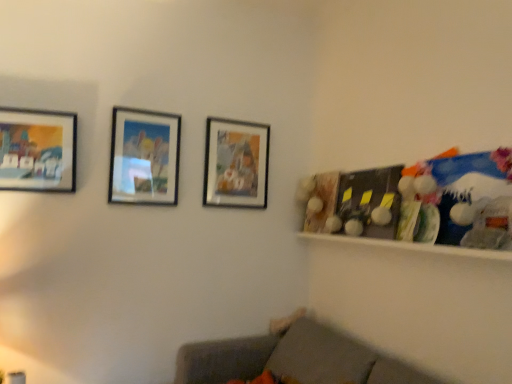
I want to click on white glossy shelf at right, so click(x=412, y=246).

You are a GUI agent. You are given a task and a screenshot of the screen. Output one action in this format:
    pyautogui.click(x=<x>, y=<y>)
    Task: Click on the matte wooden picture frame at center, which is counted as the 3th picture frame, starting from the front
    The height and width of the screenshot is (384, 512).
    Given the screenshot: What is the action you would take?
    pyautogui.click(x=236, y=164)

Is white glossy shelf at right facing away from matte glass picture frame at center, acting as the 2th picture frame starting from the front?

white glossy shelf at right does not have its back to matte glass picture frame at center, acting as the 2th picture frame starting from the front.

Is white glossy shelf at right closer to camera compared to matte glass picture frame at center, acting as the 2th picture frame starting from the front?

Yes, white glossy shelf at right is in front of matte glass picture frame at center, acting as the 2th picture frame starting from the front.

How different are the orientations of white glossy shelf at right and matte glass picture frame at center, acting as the 2th picture frame starting from the front, in degrees?

The facing directions of white glossy shelf at right and matte glass picture frame at center, acting as the 2th picture frame starting from the front, are 90.5 degrees apart.

Does gray fabric couch at lower center have a lesser height compared to matte wooden picture frame at left, the first picture frame when ordered from left to right?

No.

Considering the sizes of objects gray fabric couch at lower center and matte wooden picture frame at left, which appears as the third picture frame when viewed from the back, in the image provided, who is smaller, gray fabric couch at lower center or matte wooden picture frame at left, which appears as the third picture frame when viewed from the back,?

matte wooden picture frame at left, which appears as the third picture frame when viewed from the back.

Locate an element on the screen. The width and height of the screenshot is (512, 384). the 1st picture frame above the gray fabric couch at lower center (from a real-world perspective) is located at coordinates (38, 150).

Is gray fabric couch at lower center not close to matte wooden picture frame at left, which is the 3th picture frame from right to left?

gray fabric couch at lower center is positioned a significant distance from matte wooden picture frame at left, which is the 3th picture frame from right to left.

Is matte glass picture frame at center, which appears as the 2th picture frame when viewed from the back, turned away from matte wooden picture frame at center, marked as the 3th picture frame in a left-to-right arrangement?

No, matte glass picture frame at center, which appears as the 2th picture frame when viewed from the back, is not facing the opposite direction of matte wooden picture frame at center, marked as the 3th picture frame in a left-to-right arrangement.

Considering the positions of objects matte glass picture frame at center, which is counted as the second picture frame, starting from the left, and matte wooden picture frame at center, marked as the 1th picture frame in a back-to-front arrangement, in the image provided, who is in front, matte glass picture frame at center, which is counted as the second picture frame, starting from the left, or matte wooden picture frame at center, marked as the 1th picture frame in a back-to-front arrangement,?

matte glass picture frame at center, which is counted as the second picture frame, starting from the left, is closer to the camera.

Considering the relative sizes of matte glass picture frame at center, which appears as the 2th picture frame when viewed from the back, and matte wooden picture frame at center, acting as the 1th picture frame starting from the right, in the image provided, is matte glass picture frame at center, which appears as the 2th picture frame when viewed from the back, taller than matte wooden picture frame at center, acting as the 1th picture frame starting from the right,?

In fact, matte glass picture frame at center, which appears as the 2th picture frame when viewed from the back, may be shorter than matte wooden picture frame at center, acting as the 1th picture frame starting from the right.

Between matte glass picture frame at center, which appears as the 2th picture frame when viewed from the back, and matte wooden picture frame at center, marked as the 3th picture frame in a left-to-right arrangement, which one appears on the left side from the viewer's perspective?

From the viewer's perspective, matte glass picture frame at center, which appears as the 2th picture frame when viewed from the back, appears more on the left side.

There is a white glossy shelf at right. Where is `the 3rd picture frame above it (from the image's perspective)`? This screenshot has width=512, height=384. the 3rd picture frame above it (from the image's perspective) is located at coordinates [x=38, y=150].

Does matte wooden picture frame at left, the first picture frame when ordered from left to right, lie behind white glossy shelf at right?

That is True.

From a real-world perspective, is matte wooden picture frame at left, which is the first picture frame from front to back, positioned above or below white glossy shelf at right?

matte wooden picture frame at left, which is the first picture frame from front to back, is situated higher than white glossy shelf at right in the real world.

Is matte wooden picture frame at left, which is the first picture frame from front to back, far away from white glossy shelf at right?

Yes, matte wooden picture frame at left, which is the first picture frame from front to back, and white glossy shelf at right are located far from each other.

Can you confirm if matte wooden picture frame at center, marked as the 1th picture frame in a back-to-front arrangement, is smaller than matte wooden picture frame at left, which is the 3th picture frame from right to left?

No.

Looking at this image, from a real-world perspective, does matte wooden picture frame at center, acting as the 1th picture frame starting from the right, stand above matte wooden picture frame at left, which is the 3th picture frame from right to left?

Yes, from a real-world perspective, matte wooden picture frame at center, acting as the 1th picture frame starting from the right, is on top of matte wooden picture frame at left, which is the 3th picture frame from right to left.

Can you tell me how much matte wooden picture frame at center, which is counted as the 3th picture frame, starting from the front, and matte wooden picture frame at left, the first picture frame when ordered from left to right, differ in facing direction?

0.000749 degrees separate the facing orientations of matte wooden picture frame at center, which is counted as the 3th picture frame, starting from the front, and matte wooden picture frame at left, the first picture frame when ordered from left to right.

Is matte wooden picture frame at center, which is counted as the 3th picture frame, starting from the front, not close to matte wooden picture frame at left, the first picture frame when ordered from left to right?

Actually, matte wooden picture frame at center, which is counted as the 3th picture frame, starting from the front, and matte wooden picture frame at left, the first picture frame when ordered from left to right, are a little close together.

Is gray fabric couch at lower center taller than matte glass picture frame at center, which is counted as the second picture frame, starting from the left?

No.

From a real-world perspective, which object stands above the other?

matte glass picture frame at center, which appears as the 2th picture frame when viewed from the back.

From the image's perspective, which is below, gray fabric couch at lower center or matte glass picture frame at center, which appears as the 2th picture frame when viewed from the back?

gray fabric couch at lower center is shown below in the image.

Does gray fabric couch at lower center have a greater width compared to matte glass picture frame at center, which is counted as the second picture frame, starting from the left?

Correct, the width of gray fabric couch at lower center exceeds that of matte glass picture frame at center, which is counted as the second picture frame, starting from the left.

From the image's perspective, which is above, matte wooden picture frame at center, which is counted as the 3th picture frame, starting from the front, or matte glass picture frame at center, acting as the 2th picture frame starting from the front?

matte glass picture frame at center, acting as the 2th picture frame starting from the front, appears higher in the image.

Does matte wooden picture frame at center, marked as the 1th picture frame in a back-to-front arrangement, turn towards matte glass picture frame at center, which is counted as the second picture frame, starting from the left?

No, matte wooden picture frame at center, marked as the 1th picture frame in a back-to-front arrangement, is not facing towards matte glass picture frame at center, which is counted as the second picture frame, starting from the left.

Are matte wooden picture frame at center, which is counted as the 3th picture frame, starting from the front, and matte glass picture frame at center, the second picture frame from the right, making contact?

No, matte wooden picture frame at center, which is counted as the 3th picture frame, starting from the front, is not making contact with matte glass picture frame at center, the second picture frame from the right.

The image size is (512, 384). I want to click on shelf below the matte glass picture frame at center, which appears as the 2th picture frame when viewed from the back (from a real-world perspective), so click(412, 246).

From a real-world perspective, count 1st picture frames upward from the gray fabric couch at lower center and point to it. Please provide its 2D coordinates.

[(38, 150)]

Estimate the real-world distances between objects in this image. Which object is closer to matte wooden picture frame at center, marked as the 3th picture frame in a left-to-right arrangement, white glossy shelf at right or matte glass picture frame at center, the second picture frame from the right?

Based on the image, matte glass picture frame at center, the second picture frame from the right, appears to be nearer to matte wooden picture frame at center, marked as the 3th picture frame in a left-to-right arrangement.

Looking at this image, looking at the image, which one is located closer to matte glass picture frame at center, which appears as the 2th picture frame when viewed from the back, white glossy shelf at right or matte wooden picture frame at left, which is the 3th picture frame from right to left?

matte wooden picture frame at left, which is the 3th picture frame from right to left.

Estimate the real-world distances between objects in this image. Which object is closer to white glossy shelf at right, gray fabric couch at lower center or matte glass picture frame at center, acting as the 2th picture frame starting from the front?

The object closer to white glossy shelf at right is gray fabric couch at lower center.

Estimate the real-world distances between objects in this image. Which object is closer to matte wooden picture frame at left, which is the first picture frame from front to back, gray fabric couch at lower center or matte glass picture frame at center, which is counted as the second picture frame, starting from the left?

matte glass picture frame at center, which is counted as the second picture frame, starting from the left, is positioned closer to the anchor matte wooden picture frame at left, which is the first picture frame from front to back.

When comparing their distances from matte glass picture frame at center, which appears as the 2th picture frame when viewed from the back, does matte wooden picture frame at center, marked as the 1th picture frame in a back-to-front arrangement, or gray fabric couch at lower center seem further?

gray fabric couch at lower center is positioned further to the anchor matte glass picture frame at center, which appears as the 2th picture frame when viewed from the back.

Looking at the image, which one is located further to matte glass picture frame at center, which appears as the 2th picture frame when viewed from the back, matte wooden picture frame at center, marked as the 1th picture frame in a back-to-front arrangement, or white glossy shelf at right?

white glossy shelf at right lies further to matte glass picture frame at center, which appears as the 2th picture frame when viewed from the back, than the other object.

Estimate the real-world distances between objects in this image. Which object is further from gray fabric couch at lower center, white glossy shelf at right or matte wooden picture frame at left, which appears as the third picture frame when viewed from the back?

The object further to gray fabric couch at lower center is matte wooden picture frame at left, which appears as the third picture frame when viewed from the back.

Based on their spatial positions, is matte glass picture frame at center, acting as the 2th picture frame starting from the front, or matte wooden picture frame at left, the first picture frame when ordered from left to right, closer to white glossy shelf at right?

matte glass picture frame at center, acting as the 2th picture frame starting from the front, is closer to white glossy shelf at right.

Identify the location of shelf between gray fabric couch at lower center and matte glass picture frame at center, which appears as the 2th picture frame when viewed from the back, along the z-axis. (412, 246).

At what (x,y) coordinates should I click in order to perform the action: click on picture frame positioned between gray fabric couch at lower center and matte glass picture frame at center, acting as the 2th picture frame starting from the front, from near to far. Please return your answer as a coordinate pair (x, y). The width and height of the screenshot is (512, 384). Looking at the image, I should click on (38, 150).

Identify the location of picture frame between matte wooden picture frame at left, which is the 3th picture frame from right to left, and matte wooden picture frame at center, marked as the 3th picture frame in a left-to-right arrangement, in the horizontal direction. (144, 157).

The width and height of the screenshot is (512, 384). In order to click on shelf between gray fabric couch at lower center and matte wooden picture frame at center, which is counted as the 3th picture frame, starting from the front, along the z-axis in this screenshot , I will do `click(412, 246)`.